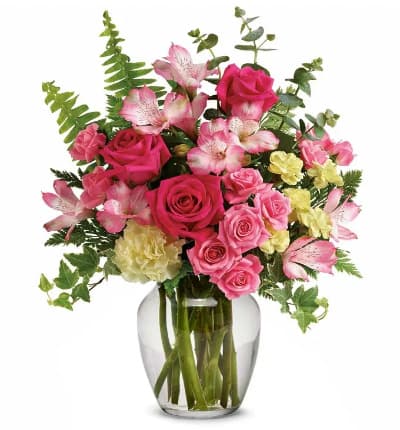
At what (x,y) coordinates should I click in order to perform the action: click on vase. Please return your answer as a coordinate pair (x, y). Looking at the image, I should click on (253, 318).